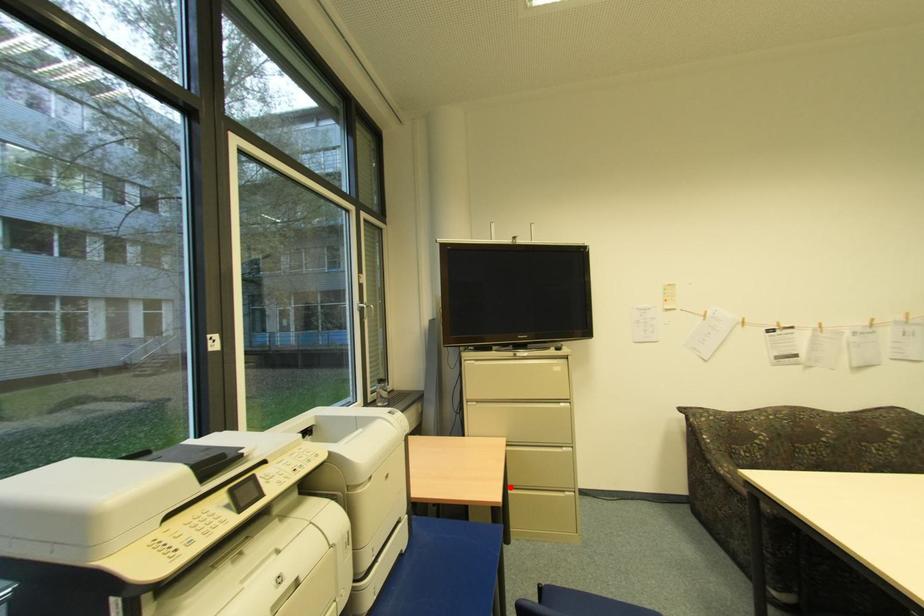
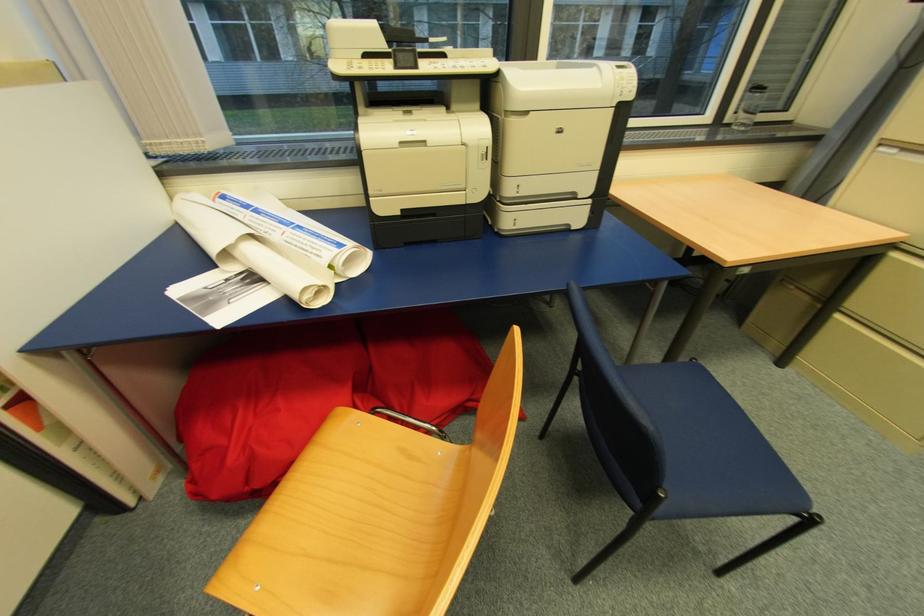
Question: I am providing you with two images of the same scene from different viewpoints. A red point is marked on the first image. Can you still see the location of the red point in image 2?

Choices:
 (A) Yes
 (B) No

Answer: (A)